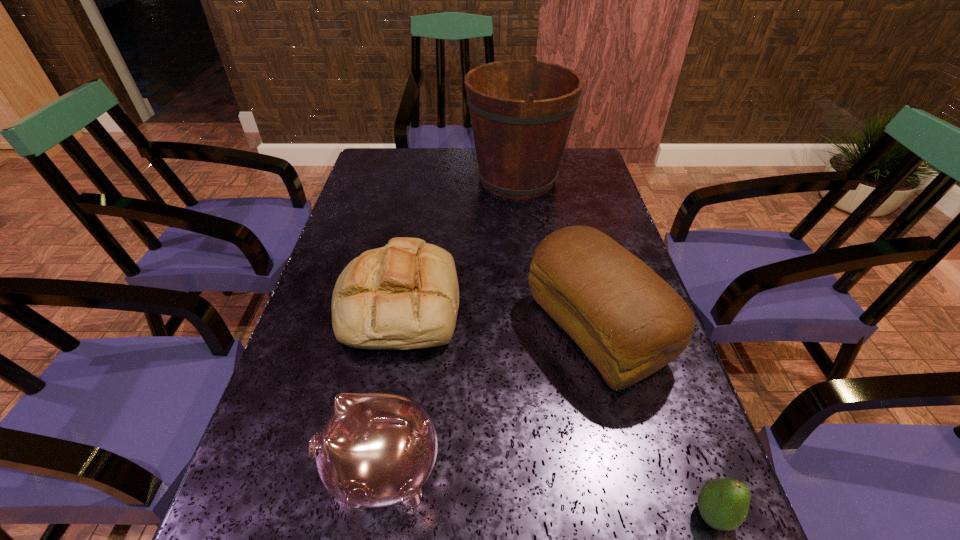
At what (x,y) coordinates should I click in order to perform the action: click on free space that satisfies the following two spatial constraints: 1. on the front facing side of the piggy bank; 2. on the right side of the avocado. Please return your answer as a coordinate pair (x, y). The width and height of the screenshot is (960, 540). Looking at the image, I should click on (375, 515).

Where is `free space that satisfies the following two spatial constraints: 1. on the front facing side of the third shortest object; 2. on the right side of the avocado`? free space that satisfies the following two spatial constraints: 1. on the front facing side of the third shortest object; 2. on the right side of the avocado is located at coordinates (375, 515).